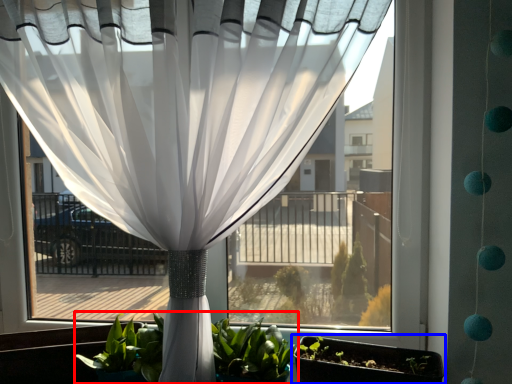
Question: Among these objects, which one is farthest to the camera, houseplant (highlighted by a red box) or flowerpot (highlighted by a blue box)?

Choices:
 (A) houseplant
 (B) flowerpot

Answer: (A)